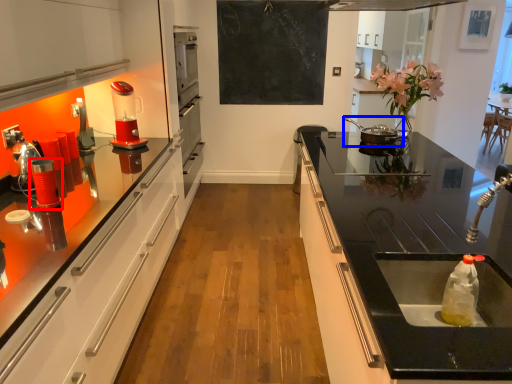
Question: Among these objects, which one is farthest to the camera, appliance (highlighted by a red box) or appliance (highlighted by a blue box)?

Choices:
 (A) appliance
 (B) appliance

Answer: (B)